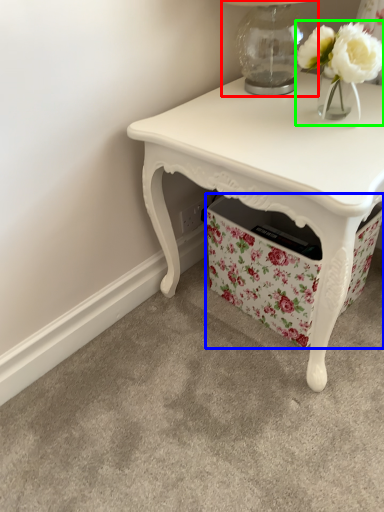
Question: Which object is the farthest from table lamp (highlighted by a red box)? Choose among these: storage box (highlighted by a blue box) or floral arrangement (highlighted by a green box).

Choices:
 (A) storage box
 (B) floral arrangement

Answer: (A)